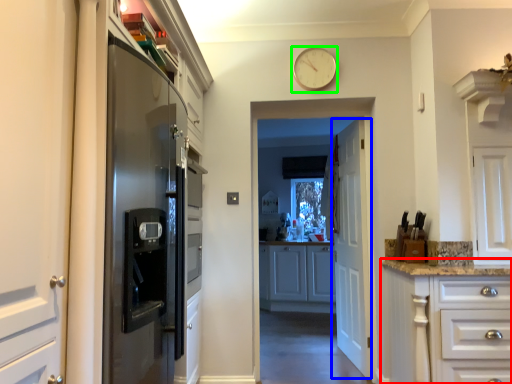
Question: Which object is the farthest from cabinetry (highlighted by a red box)? Choose among these: door (highlighted by a blue box) or clock (highlighted by a green box).

Choices:
 (A) door
 (B) clock

Answer: (B)